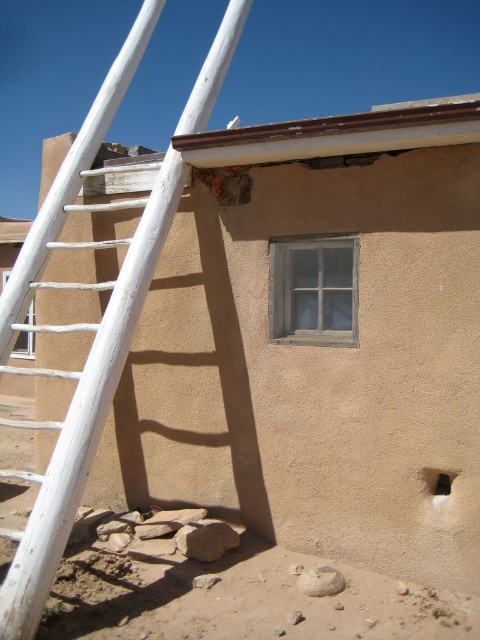
Question: Can you confirm if white wooden ladder at left is positioned above wooden frame window at center?

Choices:
 (A) yes
 (B) no

Answer: (A)

Question: Is white wooden ladder at left thinner than clear glass window at lower left?

Choices:
 (A) yes
 (B) no

Answer: (A)

Question: Can you confirm if wooden frame window at center is thinner than black matte hole at lower right?

Choices:
 (A) no
 (B) yes

Answer: (A)

Question: Among these objects, which one is farthest from the camera?

Choices:
 (A) wooden frame window at center
 (B) white wooden ladder at left

Answer: (A)

Question: Estimate the real-world distances between objects in this image. Which object is closer to the white wooden ladder at left?

Choices:
 (A) clear glass window at lower left
 (B) black matte hole at lower right
 (C) wooden frame window at center

Answer: (C)

Question: Which point is closer to the camera?

Choices:
 (A) white wooden ladder at left
 (B) clear glass window at lower left

Answer: (A)